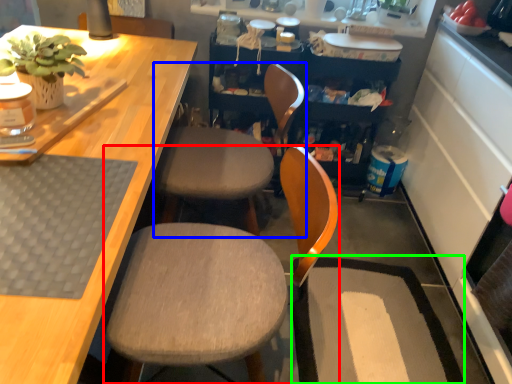
Question: Estimate the real-world distances between objects in this image. Which object is closer to chair (highlighted by a red box), chair (highlighted by a blue box) or wide (highlighted by a green box)?

Choices:
 (A) chair
 (B) wide

Answer: (A)